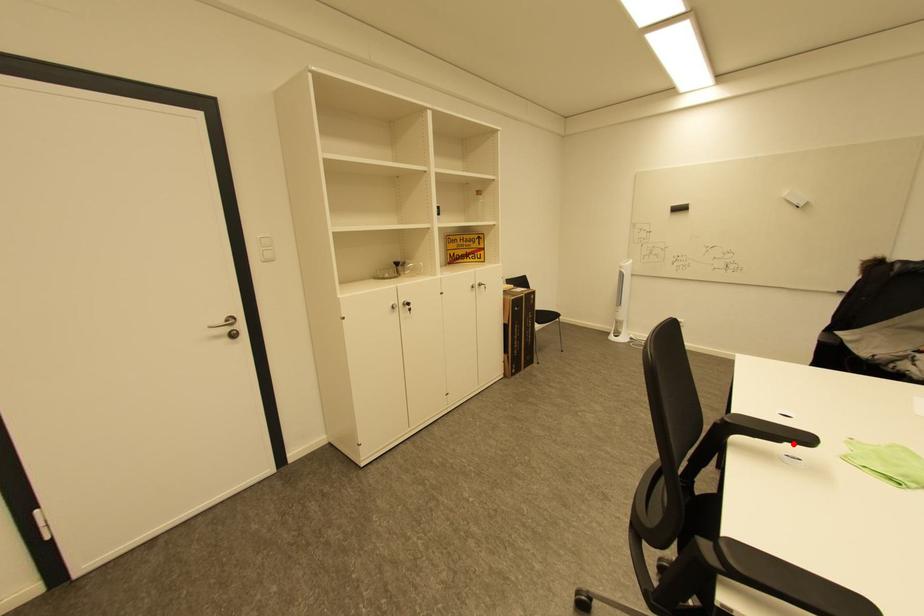
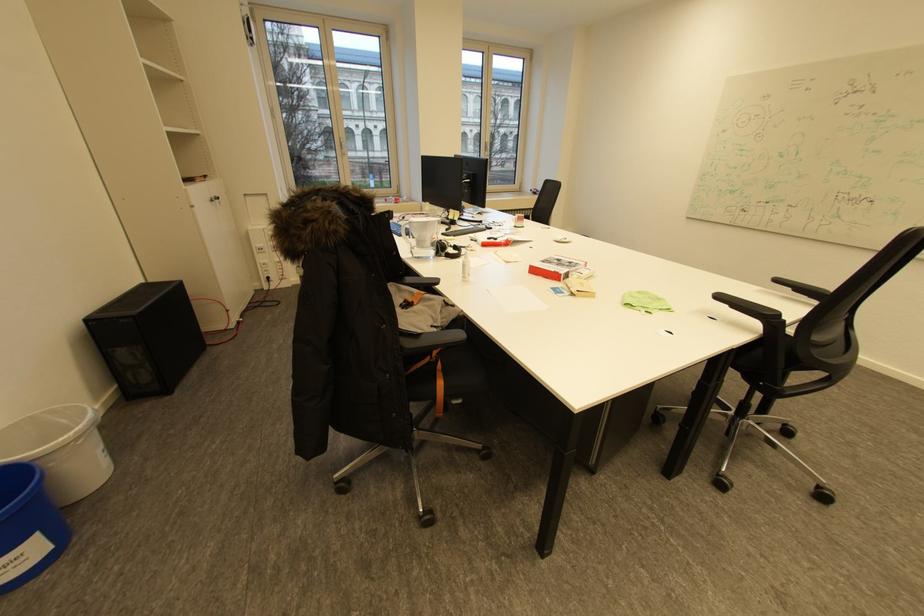
The point at the highlighted location is marked in the first image. Where is the corresponding point in the second image?

(737, 305)